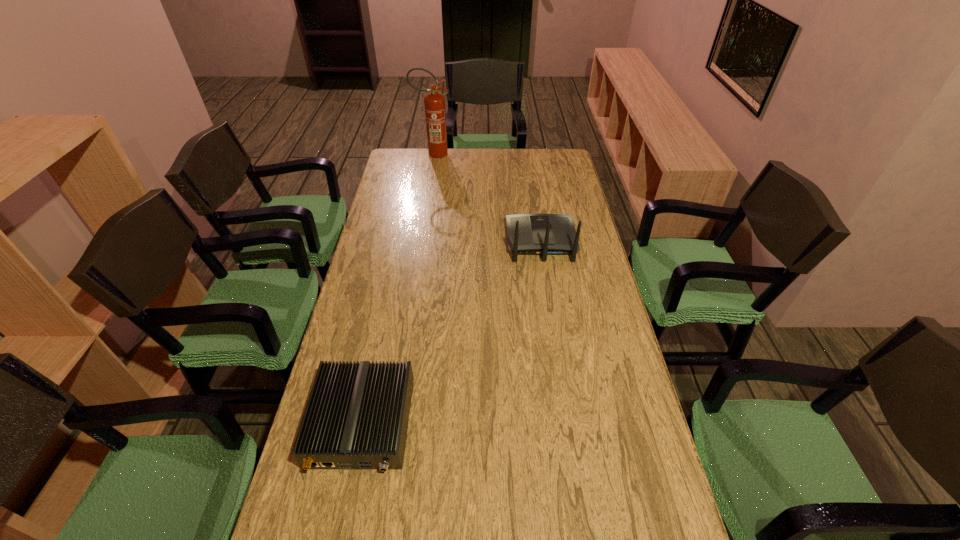
You are a GUI agent. You are given a task and a screenshot of the screen. Output one action in this format:
    pyautogui.click(x=<x>, y=<y>)
    Task: Click on the closest object to the farthest object
    
    Given the screenshot: What is the action you would take?
    pyautogui.click(x=528, y=234)

Locate an element on the screen. The image size is (960, 540). vacant area in the image that satisfies the following two spatial constraints: 1. from the nozzle of the farthest object; 2. on the back panel of the left router is located at coordinates (392, 423).

I want to click on vacant region that satisfies the following two spatial constraints: 1. on the front-facing side of the farther router; 2. from the nozzle of the tallest object, so click(x=527, y=154).

You are a GUI agent. You are given a task and a screenshot of the screen. Output one action in this format:
    pyautogui.click(x=<x>, y=<y>)
    Task: Click on the vacant space that satisfies the following two spatial constraints: 1. on the front-facing side of the right router; 2. from the nozzle of the tallest object
    Image resolution: width=960 pixels, height=540 pixels.
    Given the screenshot: What is the action you would take?
    pyautogui.click(x=527, y=154)

The width and height of the screenshot is (960, 540). Identify the location of vacant space that satisfies the following two spatial constraints: 1. from the nozzle of the farthest object; 2. on the front-facing side of the right router. (420, 241).

Locate an element on the screen. free spot that satisfies the following two spatial constraints: 1. from the nozzle of the tallest object; 2. on the front-facing side of the rightmost object is located at coordinates (420, 241).

In order to click on free space that satisfies the following two spatial constraints: 1. from the nozzle of the farthest object; 2. on the front-facing side of the second tallest object in this screenshot , I will do `click(420, 241)`.

Where is `vacant area in the image that satisfies the following two spatial constraints: 1. from the nozzle of the farthest object; 2. on the front-facing side of the farther router`? vacant area in the image that satisfies the following two spatial constraints: 1. from the nozzle of the farthest object; 2. on the front-facing side of the farther router is located at coordinates (420, 241).

Find the location of a particular element. vacant region that satisfies the following two spatial constraints: 1. on the front-facing side of the right router; 2. from the nozzle of the farthest object is located at coordinates (527, 154).

This screenshot has height=540, width=960. What are the coordinates of `free space that satisfies the following two spatial constraints: 1. on the front-facing side of the second farthest object; 2. from the nozzle of the farthest object` in the screenshot? It's located at (527, 154).